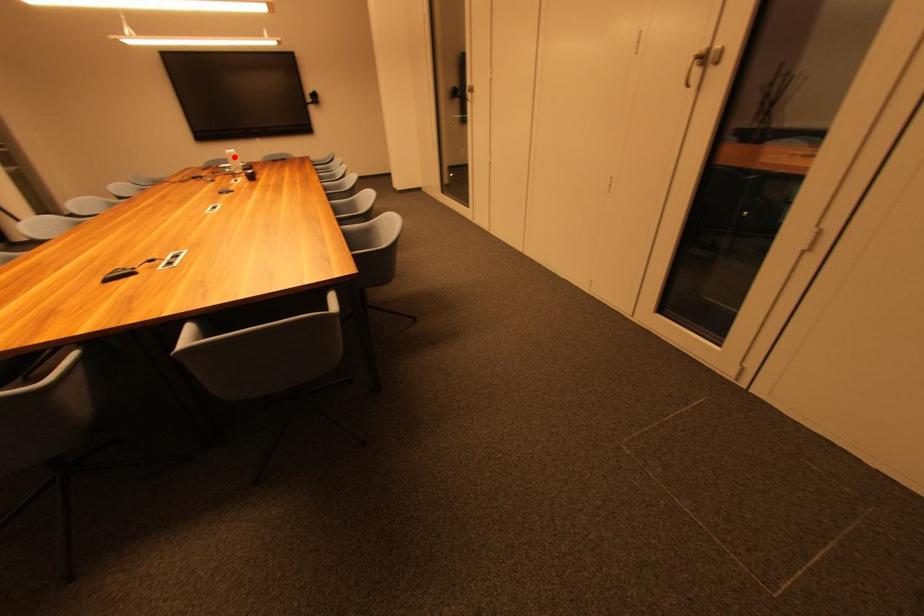
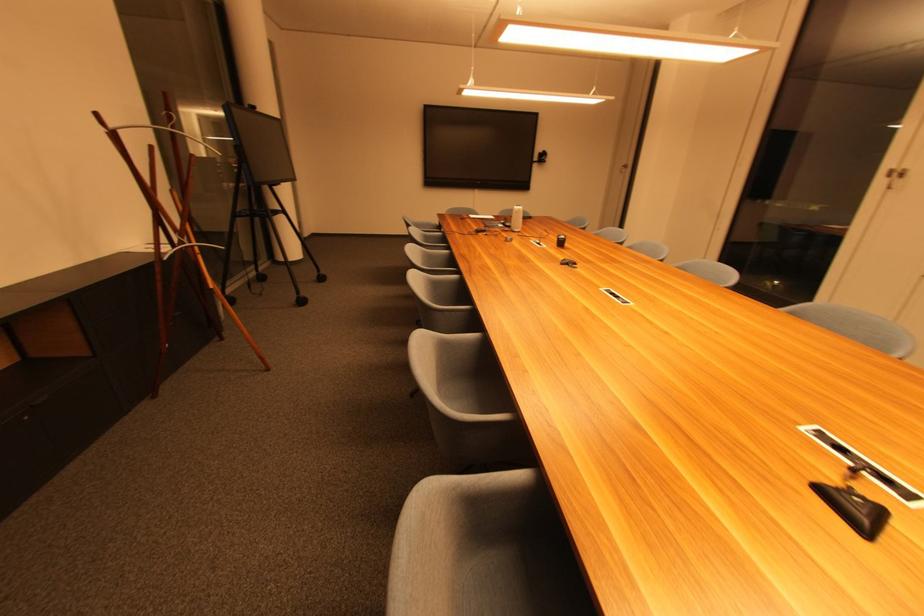
Where in the second image is the point corresponding to the highlighted location from the first image?

(521, 214)